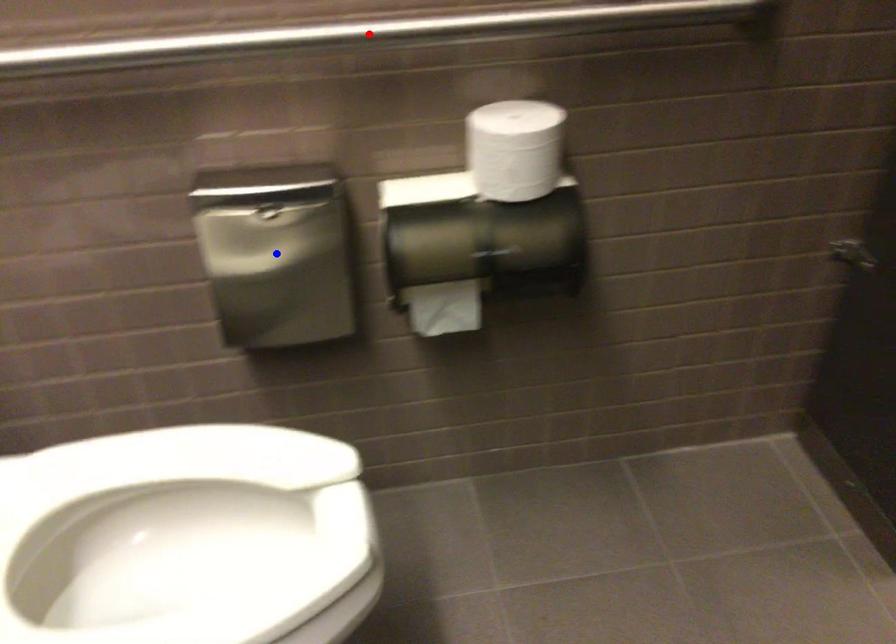
Question: Two points are marked on the image. Which point is closer to the camera?

Choices:
 (A) Blue point is closer.
 (B) Red point is closer.

Answer: (B)